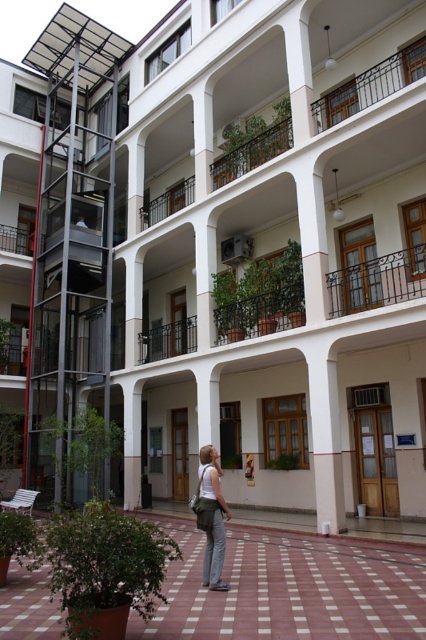
Is terracotta tiles at center closer to the viewer compared to matte white tank top at center?

That is False.

Is point (129, 614) farther from camera compared to point (219, 506)?

No, it is in front of (219, 506).

The width and height of the screenshot is (426, 640). I want to click on terracotta tiles at center, so click(290, 589).